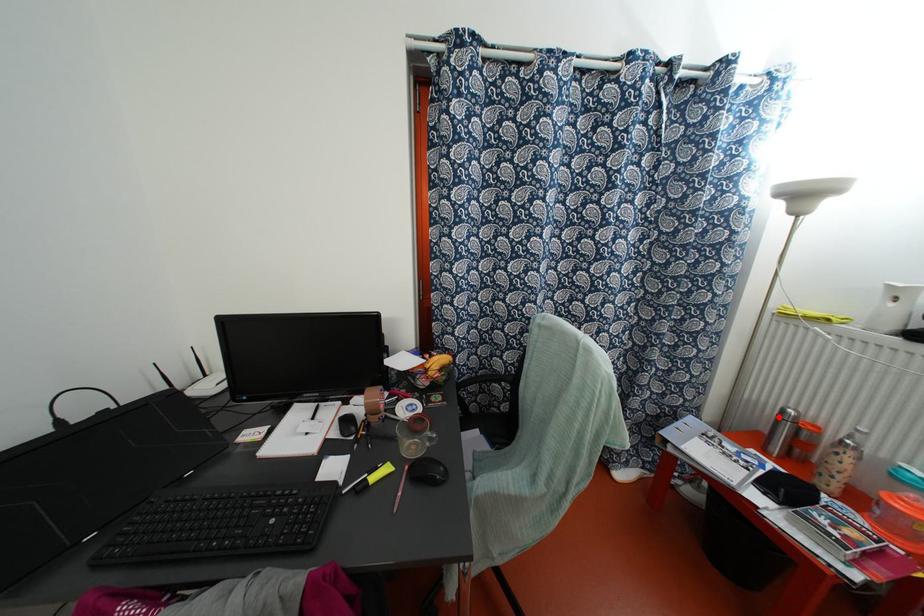
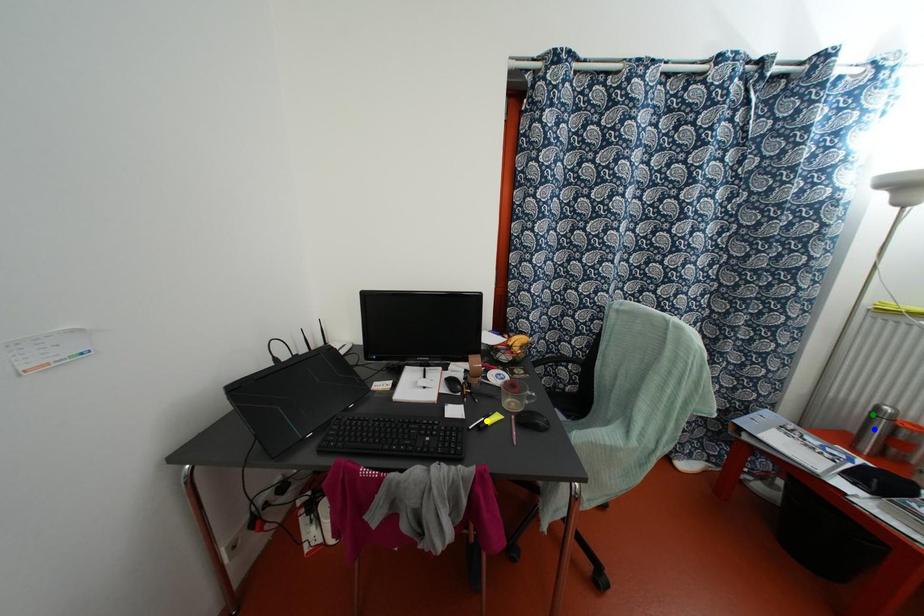
Question: I am providing you with two images of the same scene from different viewpoints. A red point is marked on the first image. You are given multiple points on the second image. Which mark in image 2 goes with the point in image 1?

Choices:
 (A) blue point
 (B) green point
 (C) yellow point

Answer: (B)